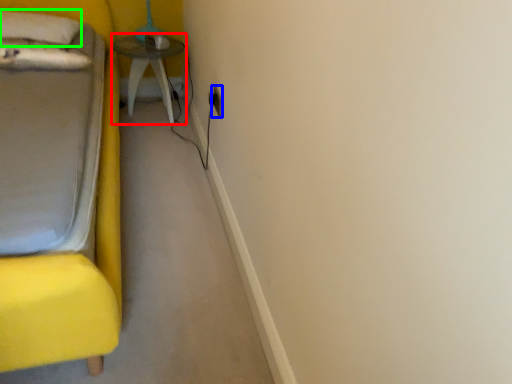
Question: Based on their relative distances, which object is nearer to table (highlighted by a red box)? Choose from electric outlet (highlighted by a blue box) and pillow (highlighted by a green box).

Choices:
 (A) electric outlet
 (B) pillow

Answer: (B)